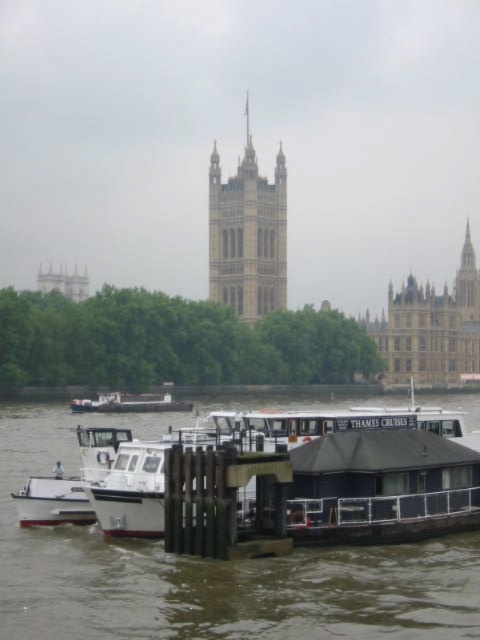
You are standing on the brown wooden dock at lower center and want to walk to the brown stone building at center. Is there a direct path from the dock to the building?

The brown wooden dock at lower center is positioned under the brown stone building at center, so there is a direct path from the dock to the building.

You are a tourist standing on the dock and want to take a photo of the stone tower at center with the white matte boat at center in the background. Based on their sizes, which object should be closer to the camera to ensure both fit in the frame?

The stone tower at center has a lesser width compared to the white matte boat at center, so to ensure both fit in the frame, the stone tower at center should be closer to the camera while the white matte boat at center is further back. This arrangement will balance their sizes in the photo.

You are standing on the dock and want to take a photo of the stone tower at center. Your camera can focus on objects up to 150 meters away. Will the tower be in focus?

The stone tower at center is 153.07 meters from viewer, which is beyond the camera focus limit of 150 meters. The tower will not be in focus.